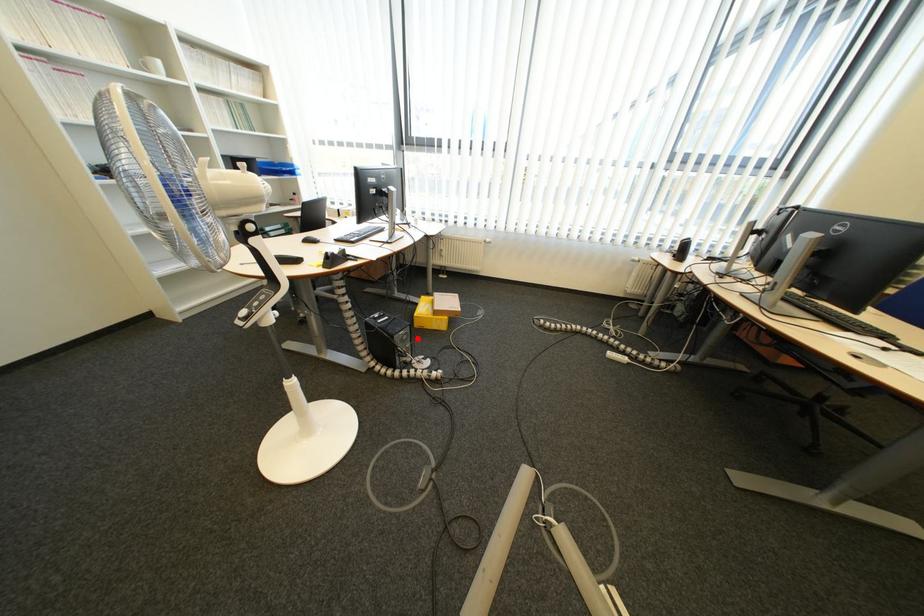
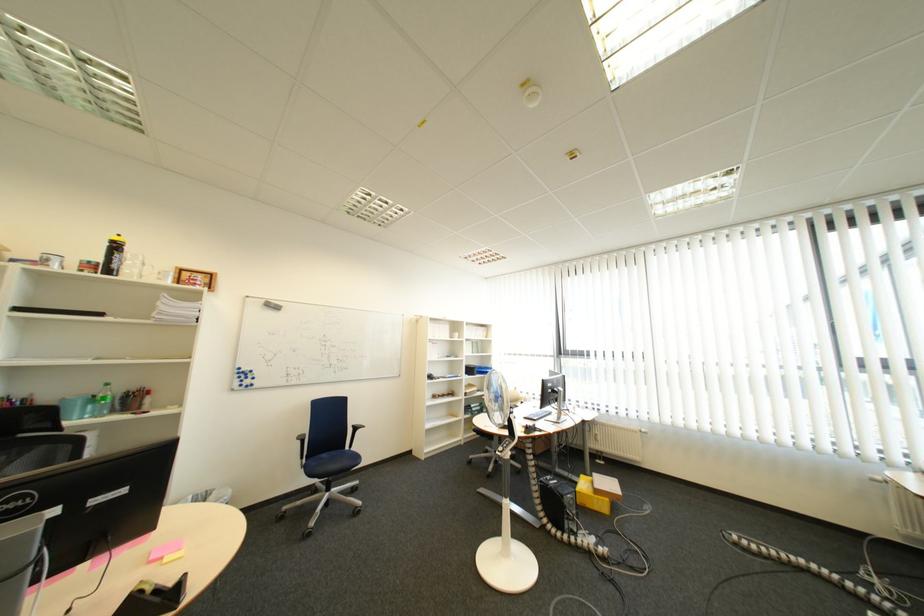
Question: I am providing you with two images of the same scene from different viewpoints. In image1, a red point is highlighted. Considering the same 3D point in image2, which of the following is correct?

Choices:
 (A) It is closer
 (B) It is farther

Answer: (B)